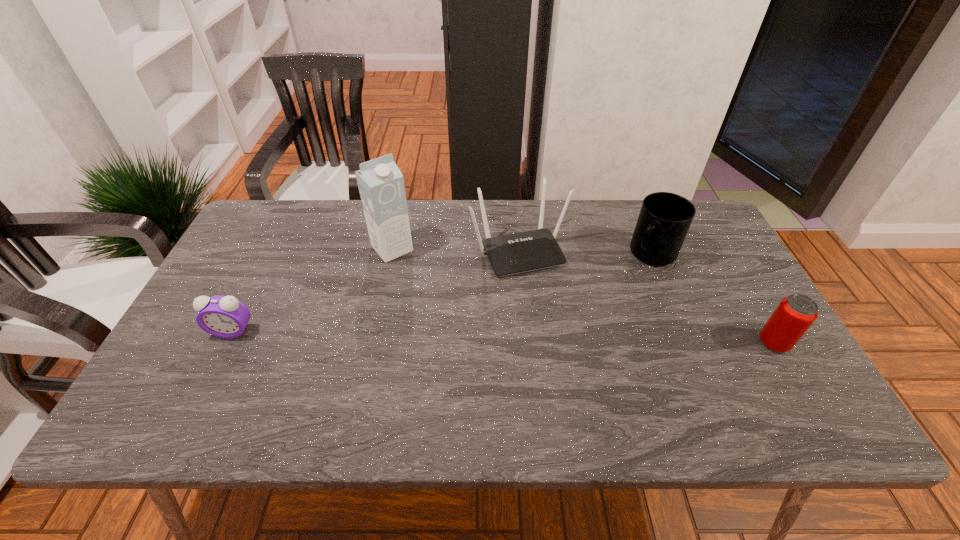
Where is `free spot at the far right corner of the desktop`? This screenshot has width=960, height=540. free spot at the far right corner of the desktop is located at coordinates (687, 247).

This screenshot has width=960, height=540. What are the coordinates of `free point between the carton and the rightmost object` in the screenshot? It's located at (583, 296).

This screenshot has height=540, width=960. In order to click on blank region between the mug and the can in this screenshot , I will do `click(712, 299)`.

Where is `free space between the rightmost object and the shortest object`? This screenshot has width=960, height=540. free space between the rightmost object and the shortest object is located at coordinates (503, 337).

Find the location of a particular element. The width and height of the screenshot is (960, 540). vacant space that's between the can and the carton is located at coordinates (583, 296).

What are the coordinates of `vacant area that lies between the leftmost object and the mug` in the screenshot? It's located at (443, 293).

At what (x,y) coordinates should I click in order to perform the action: click on unoccupied position between the can and the router. Please return your answer as a coordinate pair (x, y). The image size is (960, 540). Looking at the image, I should click on pos(646,296).

The image size is (960, 540). I want to click on vacant space in between the fourth object from right to left and the third object from right to left, so click(x=455, y=249).

Find the location of `unoccupied area between the mug and the router`. unoccupied area between the mug and the router is located at coordinates (586, 252).

Image resolution: width=960 pixels, height=540 pixels. In order to click on free space between the carton and the alarm clock in this screenshot , I will do `click(312, 290)`.